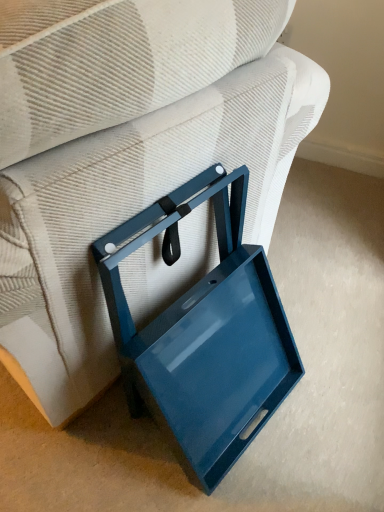
This screenshot has height=512, width=384. Find the location of `glossy blue tray at lower right`. glossy blue tray at lower right is located at coordinates (126, 154).

Image resolution: width=384 pixels, height=512 pixels. What do you see at coordinates (126, 154) in the screenshot?
I see `glossy blue tray at lower right` at bounding box center [126, 154].

The width and height of the screenshot is (384, 512). Identify the location of glossy blue tray at lower center. (204, 331).

What do you see at coordinates (204, 331) in the screenshot? Image resolution: width=384 pixels, height=512 pixels. I see `glossy blue tray at lower center` at bounding box center [204, 331].

Measure the distance between glossy blue tray at lower center and camera.

A distance of 26.74 inches exists between glossy blue tray at lower center and camera.

At what (x,y) coordinates should I click in order to perform the action: click on glossy blue tray at lower right. Please return your answer as a coordinate pair (x, y). Looking at the image, I should click on (126, 154).

Which is more to the right, glossy blue tray at lower center or glossy blue tray at lower right?

From the viewer's perspective, glossy blue tray at lower center appears more on the right side.

Between glossy blue tray at lower center and glossy blue tray at lower right, which one is positioned behind?

glossy blue tray at lower center.

Is point (226, 240) positioned in front of point (31, 49)?

That is False.

From the image's perspective, between glossy blue tray at lower center and glossy blue tray at lower right, which one is located above?

glossy blue tray at lower right appears higher in the image.

From a real-world perspective, which is physically above, glossy blue tray at lower center or glossy blue tray at lower right?

glossy blue tray at lower right.

Which object is wider, glossy blue tray at lower center or glossy blue tray at lower right?

glossy blue tray at lower right.

Is glossy blue tray at lower center taller than glossy blue tray at lower right?

Incorrect, the height of glossy blue tray at lower center is not larger of that of glossy blue tray at lower right.

Who is bigger, glossy blue tray at lower center or glossy blue tray at lower right?

glossy blue tray at lower right.

Is glossy blue tray at lower right inside glossy blue tray at lower center?

No.

Would you consider glossy blue tray at lower center to be distant from glossy blue tray at lower right?

That's not correct — glossy blue tray at lower center is a little close to glossy blue tray at lower right.

Is glossy blue tray at lower center positioned with its back to glossy blue tray at lower right?

Yes, glossy blue tray at lower center's orientation is away from glossy blue tray at lower right.

Based on the photo, how distant is glossy blue tray at lower center from glossy blue tray at lower right?

glossy blue tray at lower center is 6.02 inches away from glossy blue tray at lower right.

Where is `lunch box that appears below the glossy blue tray at lower right (from a real-world perspective)`? lunch box that appears below the glossy blue tray at lower right (from a real-world perspective) is located at coordinates (204, 331).

Considering the positions of objects glossy blue tray at lower right and glossy blue tray at lower center in the image provided, who is more to the left, glossy blue tray at lower right or glossy blue tray at lower center?

Positioned to the left is glossy blue tray at lower right.

Consider the image. Does glossy blue tray at lower right lie in front of glossy blue tray at lower center?

Yes, glossy blue tray at lower right is in front of glossy blue tray at lower center.

Does point (124, 111) come farther from viewer compared to point (222, 352)?

No, (124, 111) is closer to viewer.

From the image's perspective, is glossy blue tray at lower right beneath glossy blue tray at lower center?

No.

From a real-world perspective, which object rests below the other?

glossy blue tray at lower center.

Between glossy blue tray at lower right and glossy blue tray at lower center, which one has larger width?

glossy blue tray at lower right.

Between glossy blue tray at lower right and glossy blue tray at lower center, which one has less height?

Standing shorter between the two is glossy blue tray at lower center.

Considering the relative sizes of glossy blue tray at lower right and glossy blue tray at lower center in the image provided, is glossy blue tray at lower right bigger than glossy blue tray at lower center?

Indeed, glossy blue tray at lower right has a larger size compared to glossy blue tray at lower center.

In the scene shown: Does glossy blue tray at lower right contain glossy blue tray at lower center?

No, glossy blue tray at lower center is located outside of glossy blue tray at lower right.

Is glossy blue tray at lower right far from glossy blue tray at lower center?

No, there isn't a large distance between glossy blue tray at lower right and glossy blue tray at lower center.

In the scene shown: Is glossy blue tray at lower right facing towards glossy blue tray at lower center?

No, glossy blue tray at lower right does not turn towards glossy blue tray at lower center.

How different are the orientations of glossy blue tray at lower right and glossy blue tray at lower center in degrees?

There is a 179-degree angle between the facing directions of glossy blue tray at lower right and glossy blue tray at lower center.

I want to click on furniture above the glossy blue tray at lower center (from the image's perspective), so click(x=126, y=154).

You are a GUI agent. You are given a task and a screenshot of the screen. Output one action in this format:
    pyautogui.click(x=<x>, y=<y>)
    Task: Click on the lunch box lying on the right of glossy blue tray at lower right
    Image resolution: width=384 pixels, height=512 pixels.
    Given the screenshot: What is the action you would take?
    pyautogui.click(x=204, y=331)

You are a GUI agent. You are given a task and a screenshot of the screen. Output one action in this format:
    pyautogui.click(x=<x>, y=<y>)
    Task: Click on the furniture located above the glossy blue tray at lower center (from a real-world perspective)
    
    Given the screenshot: What is the action you would take?
    pyautogui.click(x=126, y=154)